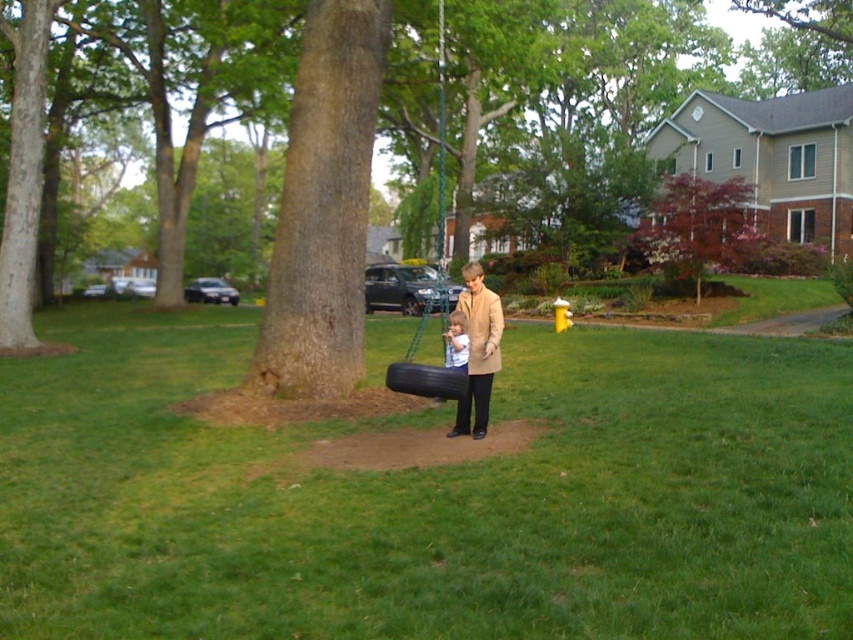
Question: Which object appears closest to the camera in this image?

Choices:
 (A) reddish-brown bark tree at upper right
 (B) light blue fabric at center
 (C) beige wool coat at center

Answer: (C)

Question: Can you confirm if black rubber tire swing at center is positioned to the right of reddish-brown bark tree at upper right?

Choices:
 (A) no
 (B) yes

Answer: (A)

Question: Which of the following is the closest to the observer?

Choices:
 (A) black rubber tire at center
 (B) brown rough tree at center

Answer: (A)

Question: Does black rubber tire swing at center lie in front of black rubber tire at center?

Choices:
 (A) no
 (B) yes

Answer: (B)

Question: Estimate the real-world distances between objects in this image. Which object is closer to the black rubber tire at center?

Choices:
 (A) beige wool coat at center
 (B) black rubber tire swing at center
 (C) reddish-brown bark tree at upper right

Answer: (B)

Question: Is black rubber tire swing at center in front of black rubber tire at center?

Choices:
 (A) yes
 (B) no

Answer: (A)